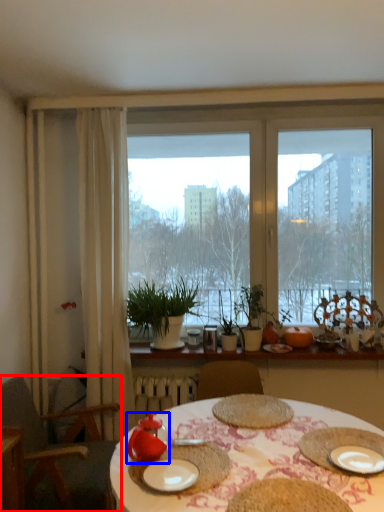
Question: Among these objects, which one is nearest to the camera, chair (highlighted by a red box) or tableware (highlighted by a blue box)?

Choices:
 (A) chair
 (B) tableware

Answer: (B)